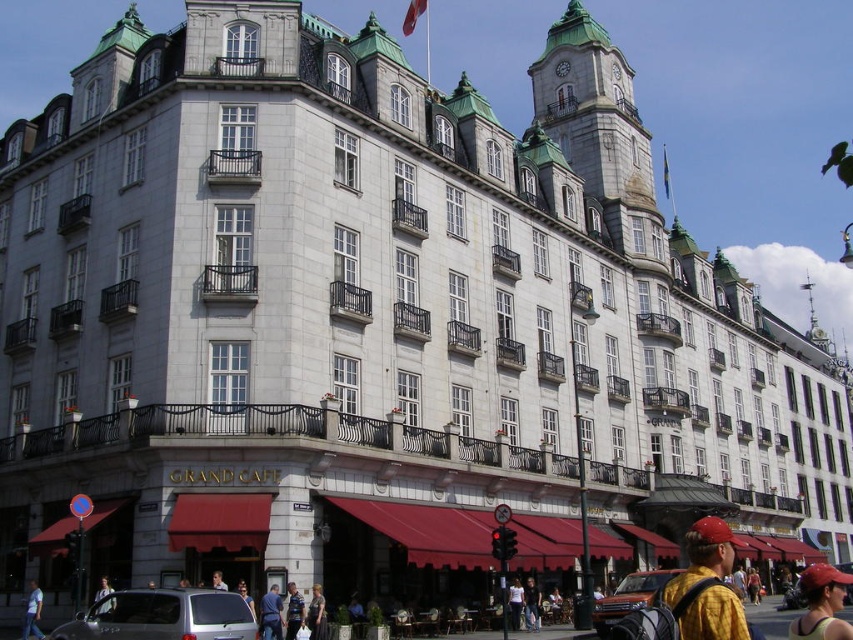
You are standing at the entrance of the Grand Cafe and see a denim jacket at lower center and a denim shorts at lower right. Which item is nearer to you?

The denim jacket at lower center is closer to the viewer than the denim shorts at lower right.

You are a customer at the Grand Cafe and want to order a drink. You see a person wearing a yellow matte shirt at lower right and another wearing a red cap at center. Which clothing item is narrower?

The yellow matte shirt at lower right is narrower than the red cap at center.

You are standing at the entrance of the Grand Cafe and want to walk to the flagpole at the top right corner of the building. There are two points marked on the path you need to take. Which point should you reach first, point (293, 634) or point (749, 579)?

You should reach point (293, 634) first because it is in front of point (749, 579), meaning it comes before the latter along your path.